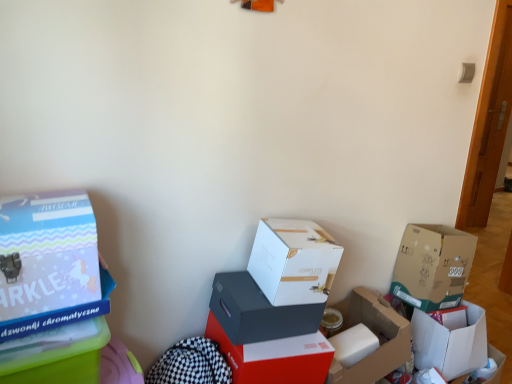
Question: Which direction should I rotate to face matte red box at center, which ranks as the third box in left-to-right order, — up or down?

Choices:
 (A) up
 (B) down

Answer: (B)

Question: Can you confirm if white matte box at center, the fourth box from the right, is wider than pastel blue cardboard box at left, the second box in the left-to-right sequence?

Choices:
 (A) yes
 (B) no

Answer: (B)

Question: Is white matte box at center, the fourth box from the right, oriented away from pastel blue cardboard box at left, the second box in the left-to-right sequence?

Choices:
 (A) no
 (B) yes

Answer: (A)

Question: Considering the relative sizes of white matte box at center, arranged as the 5th box when viewed from the left, and pastel blue cardboard box at left, which ranks as the 7th box in right-to-left order, in the image provided, is white matte box at center, arranged as the 5th box when viewed from the left, smaller than pastel blue cardboard box at left, which ranks as the 7th box in right-to-left order,?

Choices:
 (A) yes
 (B) no

Answer: (A)

Question: Is pastel blue cardboard box at left, the second box in the left-to-right sequence, inside white matte box at center, arranged as the 5th box when viewed from the left?

Choices:
 (A) yes
 (B) no

Answer: (B)

Question: Is white matte box at center, arranged as the 5th box when viewed from the left, not near pastel blue cardboard box at left, which ranks as the 7th box in right-to-left order?

Choices:
 (A) yes
 (B) no

Answer: (B)

Question: Does white matte box at center, arranged as the 5th box when viewed from the left, have a greater height compared to pastel blue cardboard box at left, which ranks as the 7th box in right-to-left order?

Choices:
 (A) no
 (B) yes

Answer: (A)

Question: Is matte red box at center, which ranks as the third box in left-to-right order, surrounding matte blue box at left, placed as the eighth box when sorted from right to left?

Choices:
 (A) yes
 (B) no

Answer: (B)

Question: Is matte red box at center, which appears as the sixth box when viewed from the right, to the right of matte blue box at left, placed as the eighth box when sorted from right to left, from the viewer's perspective?

Choices:
 (A) no
 (B) yes

Answer: (B)

Question: From a real-world perspective, is matte red box at center, which ranks as the third box in left-to-right order, under matte blue box at left, which appears as the 1th box when viewed from the left?

Choices:
 (A) yes
 (B) no

Answer: (A)

Question: Is matte red box at center, which appears as the sixth box when viewed from the right, placed right next to matte blue box at left, placed as the eighth box when sorted from right to left?

Choices:
 (A) yes
 (B) no

Answer: (B)

Question: Considering the relative sizes of matte red box at center, which appears as the sixth box when viewed from the right, and matte blue box at left, which appears as the 1th box when viewed from the left, in the image provided, is matte red box at center, which appears as the sixth box when viewed from the right, taller than matte blue box at left, which appears as the 1th box when viewed from the left,?

Choices:
 (A) yes
 (B) no

Answer: (A)

Question: Is matte red box at center, which appears as the sixth box when viewed from the right, further to the viewer compared to matte blue box at left, placed as the eighth box when sorted from right to left?

Choices:
 (A) no
 (B) yes

Answer: (B)

Question: Considering the relative sizes of matte black box at center, which is the 5th box in right-to-left order, and white matte box at center, the fourth box from the right, in the image provided, is matte black box at center, which is the 5th box in right-to-left order, taller than white matte box at center, the fourth box from the right,?

Choices:
 (A) yes
 (B) no

Answer: (B)